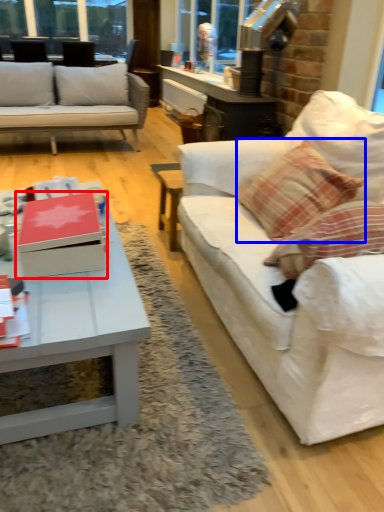
Question: Which point is further to the camera, box (highlighted by a red box) or throw pillow (highlighted by a blue box)?

Choices:
 (A) box
 (B) throw pillow

Answer: (B)